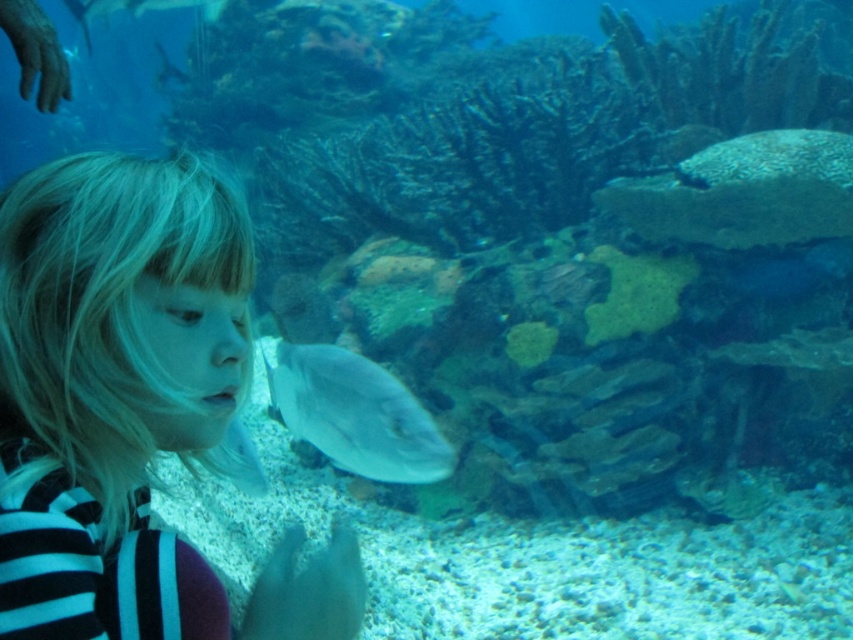
You are a parent standing in front of the aquarium glass, holding your child who has blonde hair at left. You want to ensure the child can safely touch the glass without getting too close to the edge. The safe touching distance is 30 inches. Can the child reach the glass while maintaining the safe distance?

The distance between the blonde hair at left and the viewer is 30.41 inches, which is slightly more than the 30 inches required for safe touching distance. Therefore, the child can safely touch the glass while maintaining the safe distance.

You are a marine biologist observing the aquarium scene. You notice the blonde hair at left and the shiny silver fish at center. Which object is located to the left of the other?

The blonde hair at left is positioned on the left side of shiny silver fish at center.